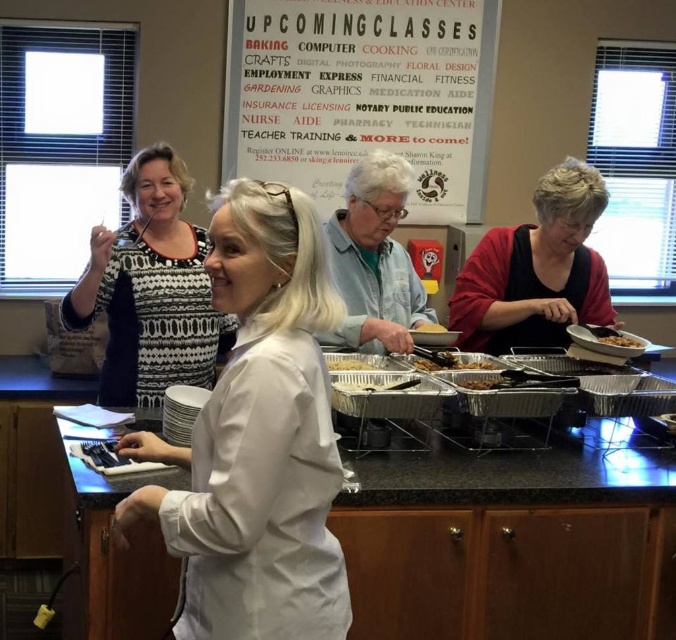
Based on the photo, you are standing at the entrance of the community center and want to locate the black granite counter at center where the food is being served. According to the coordinates provided, where should you look to find it?

The black granite counter at center is located at coordinates point [504,536].

You are planning to place a decorative plate on the black granite counter at center next to the brown matte bowl at right. Considering the counter and bowl sizes, will there be enough space for the plate?

The black granite counter at center is wider than the brown matte bowl at right, so there should be sufficient space to place the decorative plate next to the bowl.